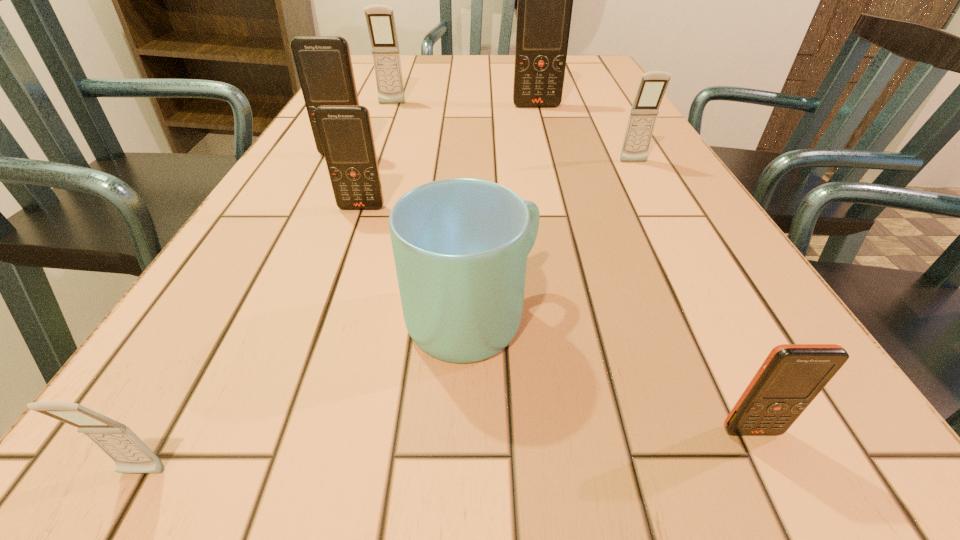
Locate an element on the screen. The image size is (960, 540). the biggest orange cellular telephone is located at coordinates (545, 0).

This screenshot has height=540, width=960. What are the coordinates of `the third object from right to left` in the screenshot? It's located at (545, 0).

The width and height of the screenshot is (960, 540). In order to click on the biggest gray cellular telephone in this screenshot , I will do `click(380, 19)`.

This screenshot has height=540, width=960. Find the location of `the second gray cellular telephone from left to right`. the second gray cellular telephone from left to right is located at coordinates (380, 19).

This screenshot has height=540, width=960. What are the coordinates of `the second farthest orange cellular telephone` in the screenshot? It's located at (323, 63).

Locate an element on the screen. This screenshot has width=960, height=540. the second biggest orange cellular telephone is located at coordinates (323, 63).

Where is `the fourth farthest cellular telephone`? Image resolution: width=960 pixels, height=540 pixels. the fourth farthest cellular telephone is located at coordinates (653, 84).

Locate an element on the screen. Image resolution: width=960 pixels, height=540 pixels. the fourth farthest object is located at coordinates coord(653,84).

At what (x,y) coordinates should I click in order to perform the action: click on the second nearest orange cellular telephone. Please return your answer as a coordinate pair (x, y). Looking at the image, I should click on (346, 134).

Find the location of a particular element. The image size is (960, 540). the third biggest orange cellular telephone is located at coordinates (346, 134).